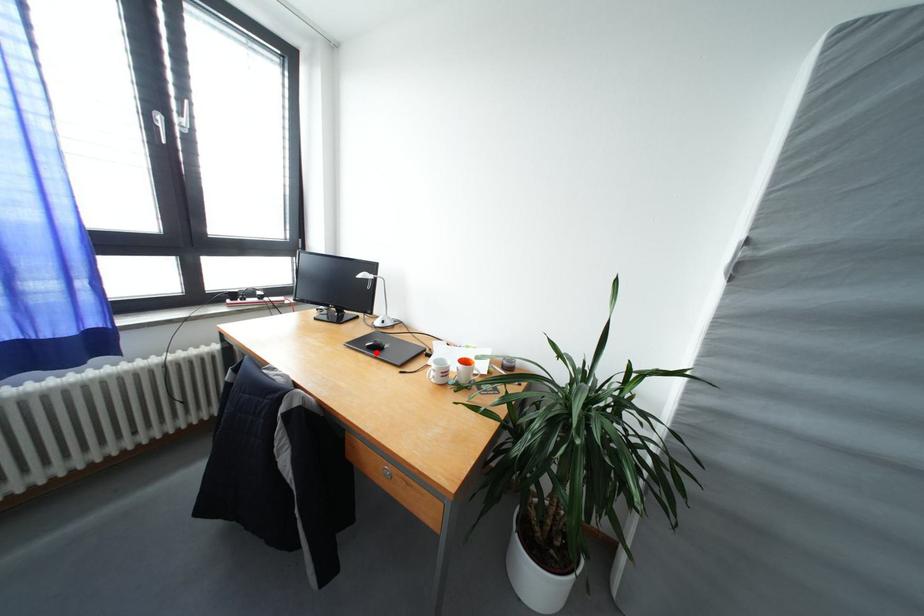
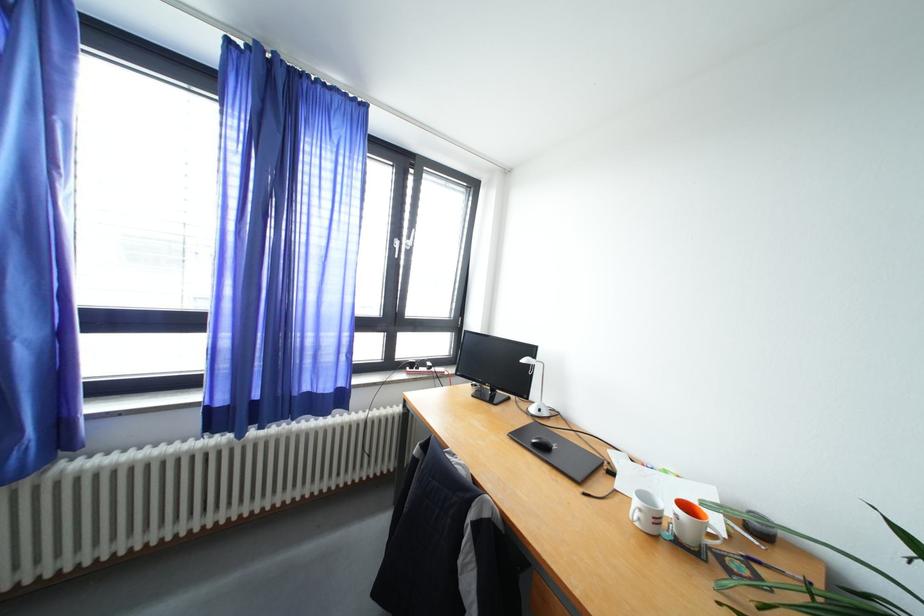
Where in the second image is the point corresponding to the highlighted location from the first image?

(541, 450)